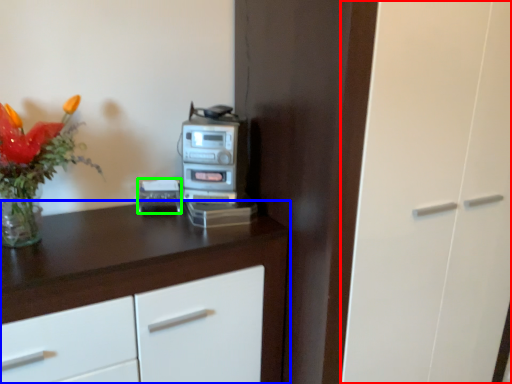
Question: Which is farther away from glass door (highlighted by a red box)? cabinetry (highlighted by a blue box) or appliance (highlighted by a green box)?

Choices:
 (A) cabinetry
 (B) appliance

Answer: (B)